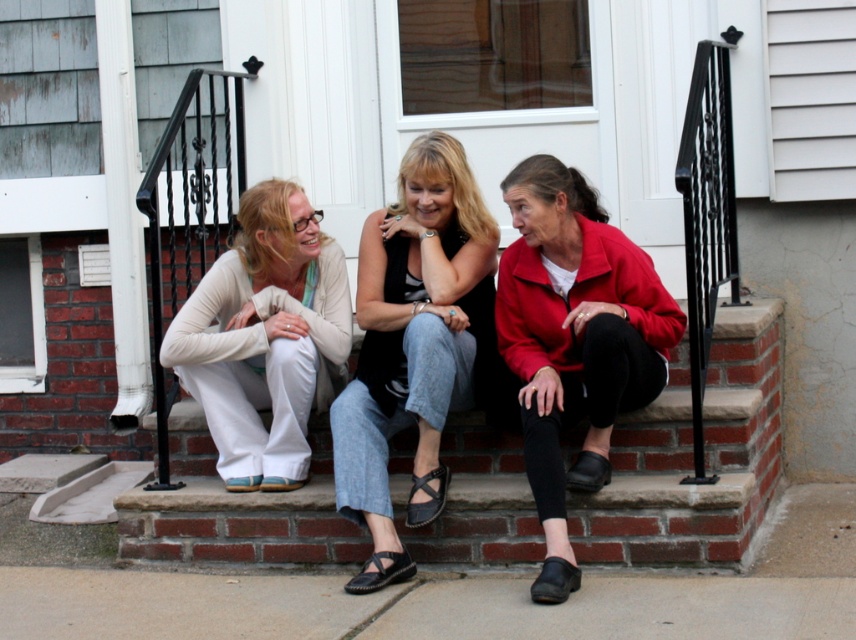
You are standing in front of the white door with a window and want to walk towards the point labeled point (x=739, y=394) and point (x=265, y=486). Which point will you reach first?

You will reach point (x=265, y=486) first because it is closer to you than point (x=739, y=394), which is further away.

You are standing on the red brick steps and want to take a photo of the denim jeans at center and the matte white pants at center. Which one will appear larger in the photo?

The denim jeans at center will appear larger in the photo because it is in front of the matte white pants at center, making it closer to the camera.